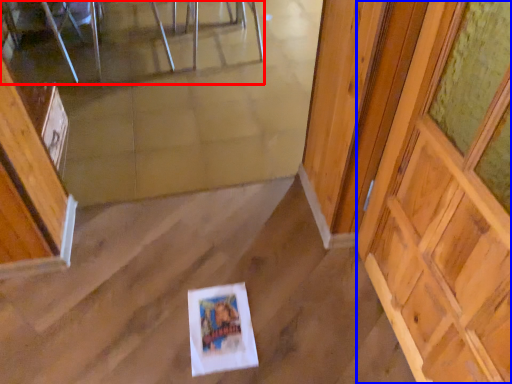
Question: Among these objects, which one is farthest to the camera, furniture (highlighted by a red box) or barn door (highlighted by a blue box)?

Choices:
 (A) furniture
 (B) barn door

Answer: (A)